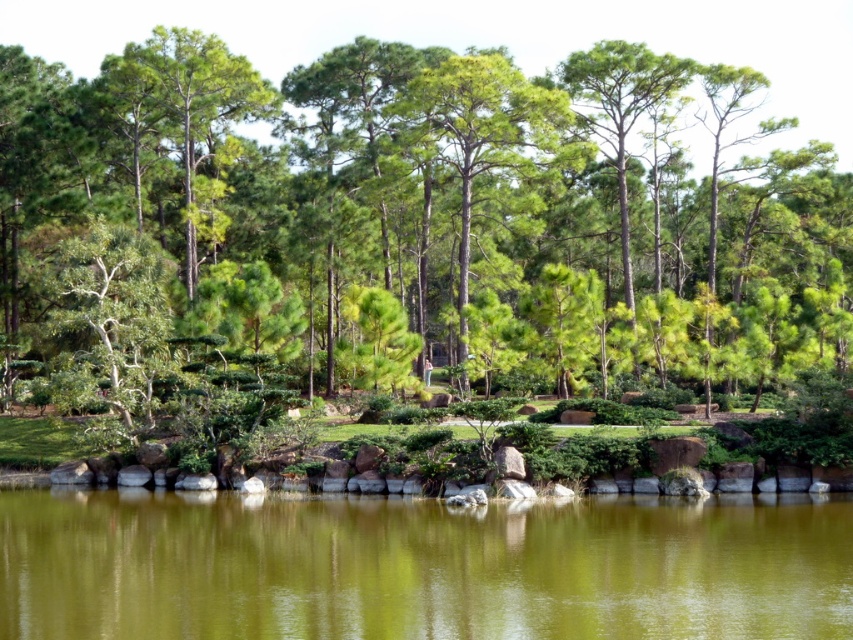
Is point (386, 236) closer to viewer compared to point (820, 529)?

No, it is behind (820, 529).

What do you see at coordinates (401, 186) in the screenshot? I see `green leafy tree at center` at bounding box center [401, 186].

Where is `green leafy tree at center`? green leafy tree at center is located at coordinates (401, 186).